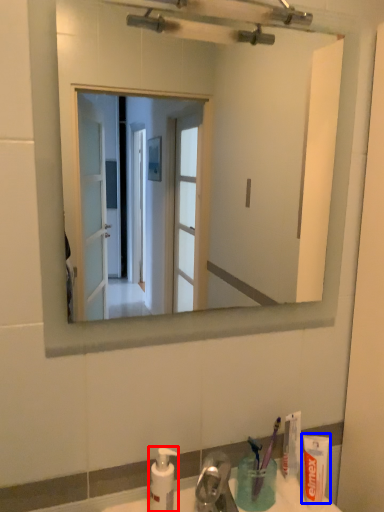
Question: Which object appears farthest to the camera in this image, soap dispenser (highlighted by a red box) or toothpaste (highlighted by a blue box)?

Choices:
 (A) soap dispenser
 (B) toothpaste

Answer: (B)